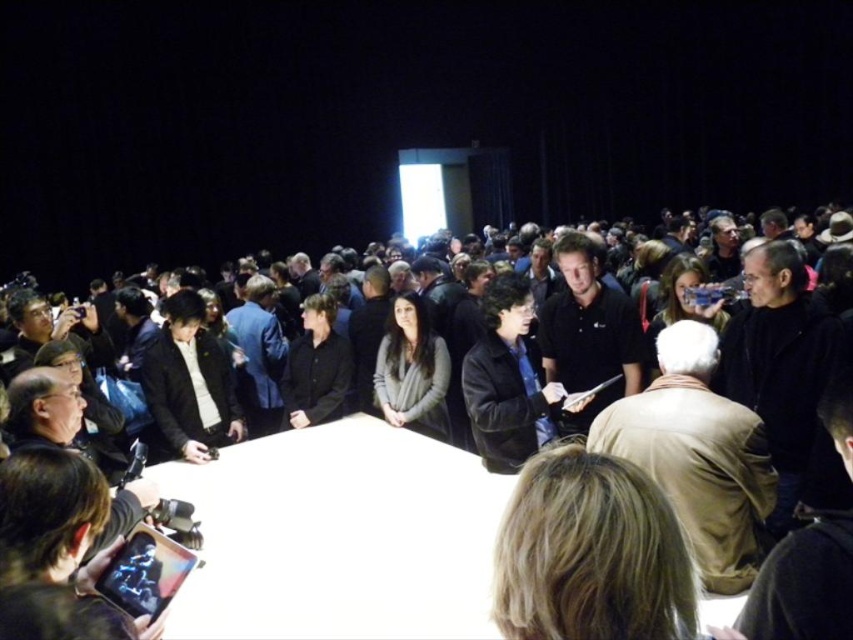
You are standing at the point marked as point (498, 308). The nearest exit is 10.21 feet away. If you need to evacuate quickly, can you reach the nearest exit within 3 seconds?

The nearest exit is 10.21 feet away from point (498, 308). To determine if you can reach it within 3 seconds, consider your walking speed. A typical walking speed is about 3 feet per second, so 3 seconds would cover 9 feet. Since 10.21 feet is slightly more than that, you might need to walk a bit faster or the exit may not be reachable in exactly 3 seconds.

You are a photographer at the event and need to place your camera bag, which is 1 meter wide, on the white glossy table at center. Can the brown leather jacket at lower right be moved to make space?

The white glossy table at center might be wider than brown leather jacket at lower right, so it is possible that there is enough space for the camera bag. However, since the exact width difference is uncertain, moving the brown leather jacket at lower right could help ensure sufficient space.